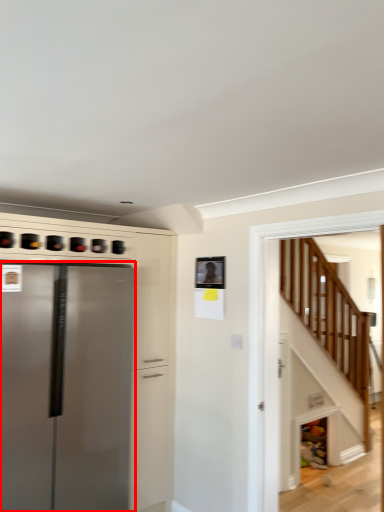
Question: From the image, what is the correct spatial relationship of refrigerator (annotated by the red box) in relation to stairwell?

Choices:
 (A) right
 (B) left

Answer: (B)